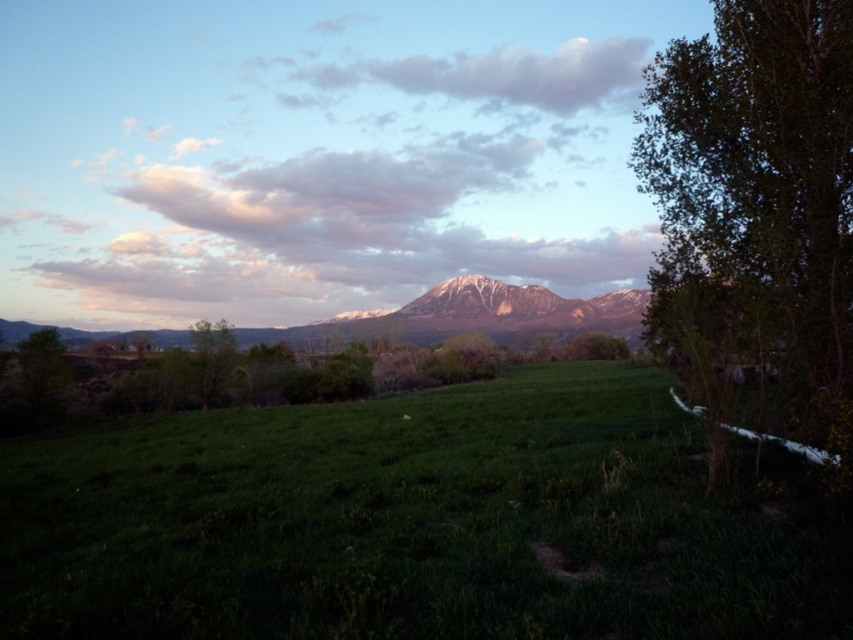
Is green leafy tree at right bigger than snowy rock mountain at center?

Yes.

Is green leafy tree at right wider than snowy rock mountain at center?

In fact, green leafy tree at right might be narrower than snowy rock mountain at center.

Locate an element on the screen. Image resolution: width=853 pixels, height=640 pixels. green leafy tree at right is located at coordinates (756, 214).

Identify the location of green leafy tree at right. The width and height of the screenshot is (853, 640). (756, 214).

Can you confirm if cloudy sky at upper center is positioned below snowy rock mountain at center?

Actually, cloudy sky at upper center is above snowy rock mountain at center.

The width and height of the screenshot is (853, 640). I want to click on cloudy sky at upper center, so click(503, 74).

Who is taller, green grassy field at center or cloudy sky at upper center?

With more height is cloudy sky at upper center.

Who is lower down, green grassy field at center or cloudy sky at upper center?

green grassy field at center is lower down.

Locate an element on the screen. The image size is (853, 640). green grassy field at center is located at coordinates (418, 522).